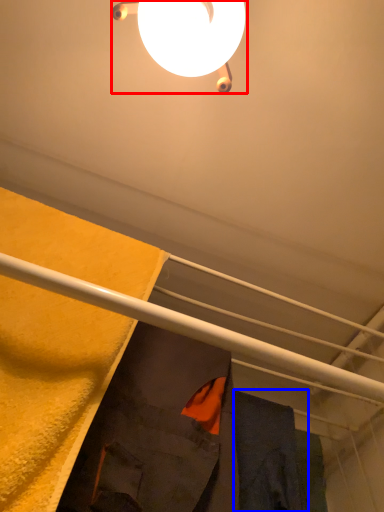
Question: Which of the following is the closest to the observer, lamp (highlighted by a red box) or robe (highlighted by a blue box)?

Choices:
 (A) lamp
 (B) robe

Answer: (A)